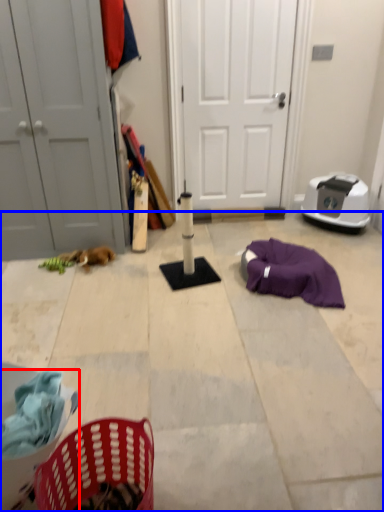
Question: Which point is further to the camera, basket (highlighted by a red box) or concrete (highlighted by a blue box)?

Choices:
 (A) basket
 (B) concrete

Answer: (B)